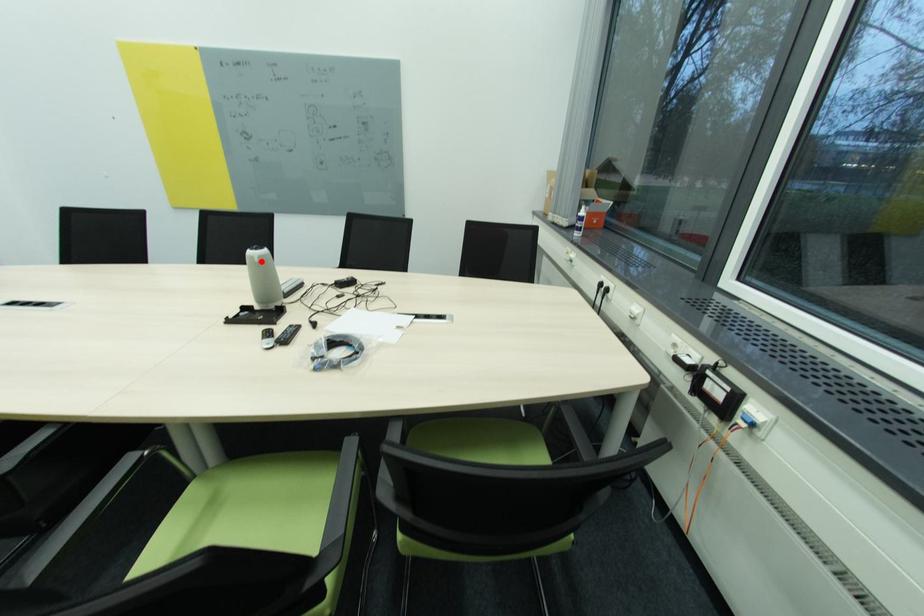
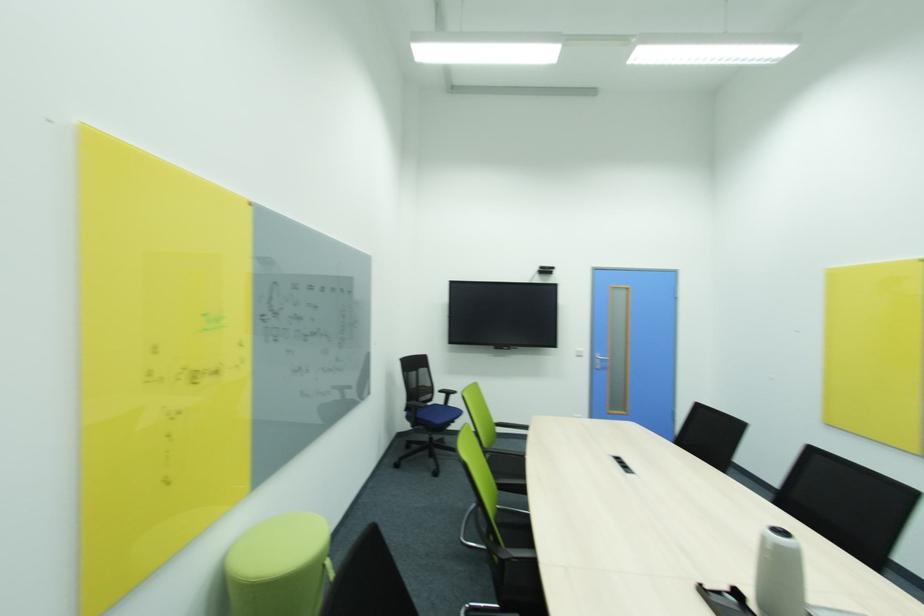
Find the pixel in the second image that matches the highlighted location in the first image.

(774, 548)